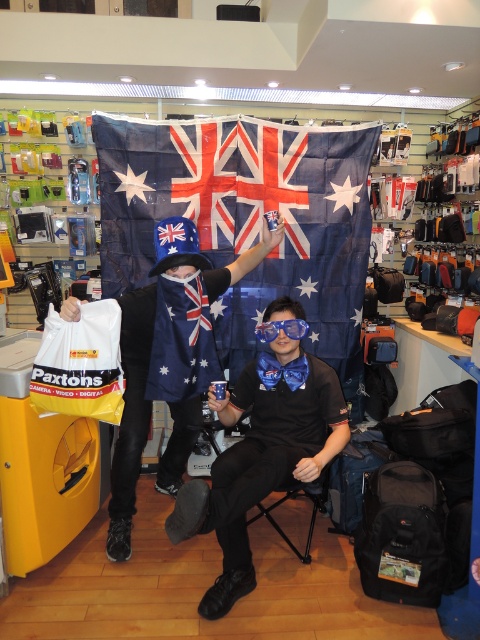
Question: Which object is the closest to the matte black shirt at center?

Choices:
 (A) blue fabric flag at center
 (B) blue fabric hat at center
 (C) blue glossy goggles at center

Answer: (C)

Question: Does blue fabric flag at center appear on the left side of matte black shirt at center?

Choices:
 (A) yes
 (B) no

Answer: (B)

Question: Estimate the real-world distances between objects in this image. Which object is closer to the blue fabric hat at center?

Choices:
 (A) blue glossy goggles at center
 (B) blue fabric flag at center
 (C) matte black shirt at center

Answer: (C)

Question: Is blue fabric flag at center closer to camera compared to blue fabric hat at center?

Choices:
 (A) yes
 (B) no

Answer: (B)

Question: Which of these objects is positioned farthest from the blue fabric flag at center?

Choices:
 (A) blue glossy goggles at center
 (B) matte black shirt at center

Answer: (A)

Question: From the image, what is the correct spatial relationship of matte black shirt at center in relation to blue glossy goggles at center?

Choices:
 (A) above
 (B) below

Answer: (B)